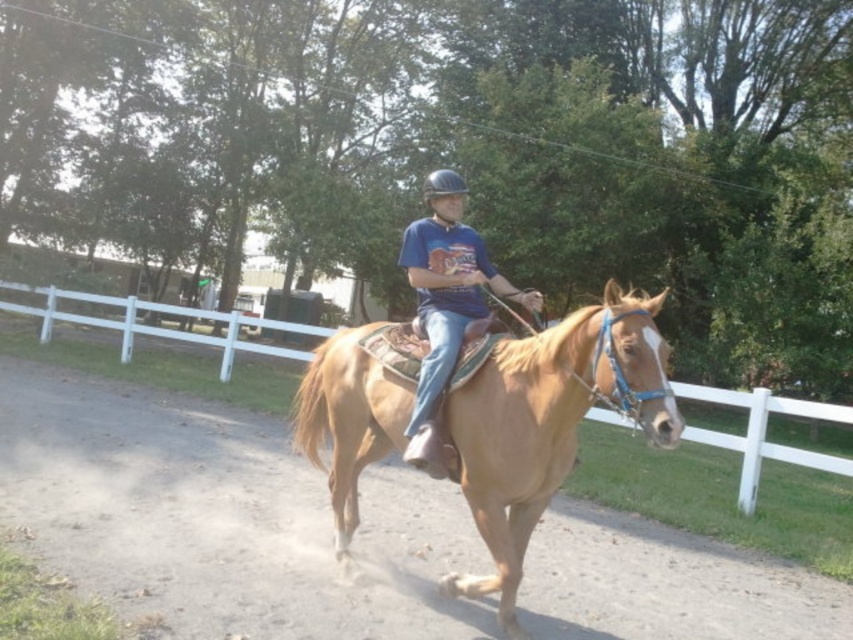
You are a horseback rider approaching the white wooden fence at center and the black hard helmet at center. The fence is 7.44 meters away from the helmet. If your horse can jump over obstacles up to 8 meters away, will it be able to clear the fence?

The distance between the white wooden fence at center and the black hard helmet at center is 7.44 meters. Since the horse can jump up to 8 meters, it can safely clear the fence.

You are a photographer trying to capture a photo of the light brown leather horse at center and the white wooden fence at center. Which object is shorter in the scene?

The light brown leather horse at center is not as tall as the white wooden fence at center, so the horse is shorter.